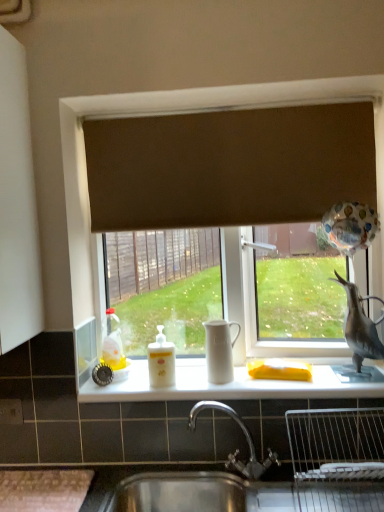
Question: Considering the relative sizes of white glossy counter top at center and brown fabric curtain at upper center in the image provided, is white glossy counter top at center taller than brown fabric curtain at upper center?

Choices:
 (A) yes
 (B) no

Answer: (B)

Question: From a real-world perspective, is white glossy counter top at center located higher than brown fabric curtain at upper center?

Choices:
 (A) yes
 (B) no

Answer: (B)

Question: Does white glossy counter top at center touch brown fabric curtain at upper center?

Choices:
 (A) no
 (B) yes

Answer: (A)

Question: From the image's perspective, is white glossy counter top at center on top of brown fabric curtain at upper center?

Choices:
 (A) yes
 (B) no

Answer: (B)

Question: Can you confirm if white glossy counter top at center is positioned to the right of brown fabric curtain at upper center?

Choices:
 (A) yes
 (B) no

Answer: (A)

Question: Is white glossy counter top at center shorter than brown fabric curtain at upper center?

Choices:
 (A) yes
 (B) no

Answer: (A)

Question: From the image's perspective, is translucent plastic bottle at left below brown fabric curtain at upper center?

Choices:
 (A) yes
 (B) no

Answer: (A)

Question: Is translucent plastic bottle at left at the left side of brown fabric curtain at upper center?

Choices:
 (A) no
 (B) yes

Answer: (B)

Question: From a real-world perspective, is translucent plastic bottle at left positioned over brown fabric curtain at upper center based on gravity?

Choices:
 (A) no
 (B) yes

Answer: (A)

Question: Is translucent plastic bottle at left facing towards brown fabric curtain at upper center?

Choices:
 (A) yes
 (B) no

Answer: (B)

Question: Is translucent plastic bottle at left positioned behind brown fabric curtain at upper center?

Choices:
 (A) yes
 (B) no

Answer: (A)

Question: Is brown fabric curtain at upper center completely or partially inside translucent plastic bottle at left?

Choices:
 (A) no
 (B) yes

Answer: (A)

Question: From the image's perspective, is brown fabric curtain at upper center over white matte tea pot at center?

Choices:
 (A) yes
 (B) no

Answer: (A)